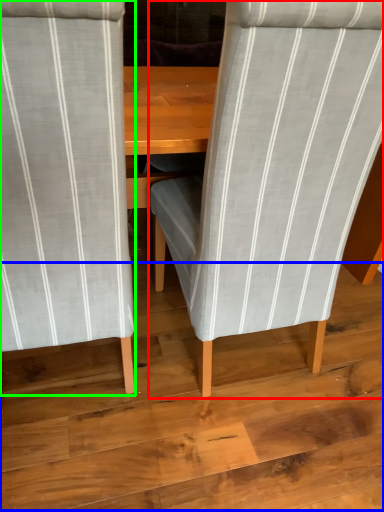
Question: Based on their relative distances, which object is nearer to chair (highlighted by a red box)? Choose from plywood (highlighted by a blue box) and chair (highlighted by a green box).

Choices:
 (A) plywood
 (B) chair

Answer: (B)